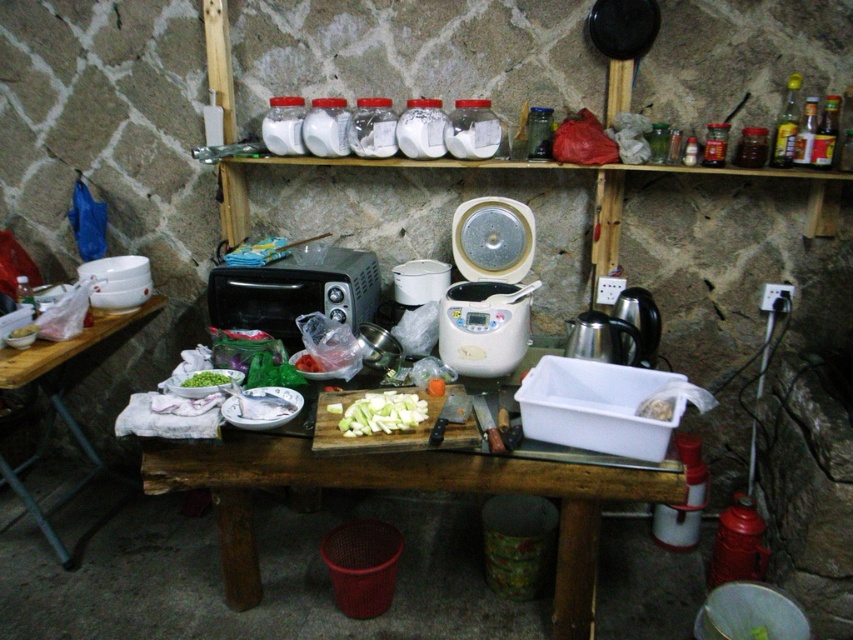
Between wooden cutting board at center and green matte bowl at center, which one is positioned lower?

wooden cutting board at center is lower down.

Can you confirm if wooden cutting board at center is shorter than green matte bowl at center?

No, wooden cutting board at center is not shorter than green matte bowl at center.

Is point (587, 474) positioned after point (193, 387)?

No.

Locate an element on the screen. wooden cutting board at center is located at coordinates (401, 490).

Is point (268, 323) less distant than point (199, 380)?

No, (268, 323) is behind (199, 380).

Looking at this image, which is more to the left, matte black toaster oven at center or green matte bowl at center?

Positioned to the left is green matte bowl at center.

Does point (287, 304) come farther from viewer compared to point (187, 380)?

Yes, it is behind point (187, 380).

Identify the location of matte black toaster oven at center. The height and width of the screenshot is (640, 853). (294, 292).

Looking at this image, between wooden cutting board at center and green matte bowl at lower left, which one has less height?

green matte bowl at lower left

Between point (592, 636) and point (28, 328), which one is positioned behind?

Positioned behind is point (28, 328).

Locate an element on the screen. wooden cutting board at center is located at coordinates (401, 490).